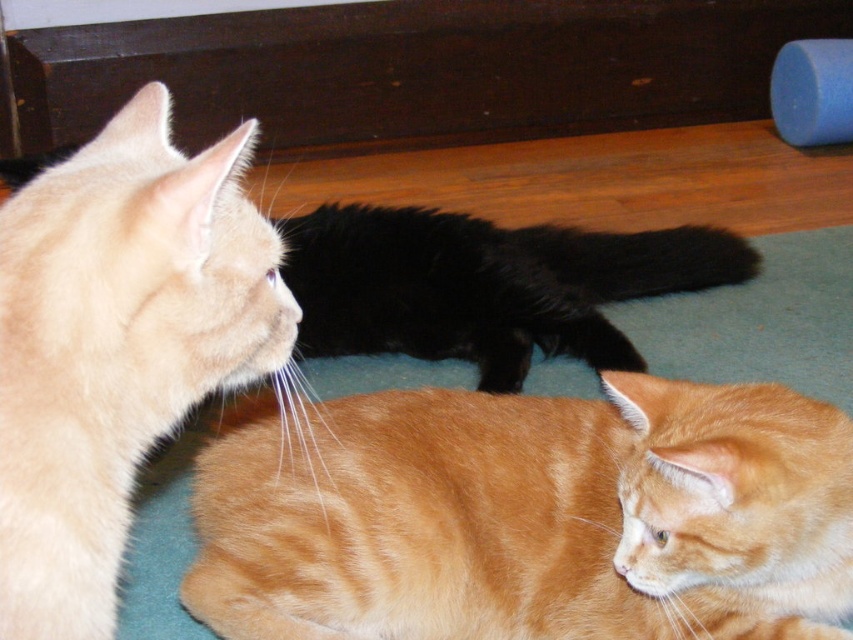
In the scene shown: Who is more distant from viewer, [607,570] or [149,250]?

The point [607,570] is more distant.

Between orange fur cat at lower center and light orange fur cat at upper left, which one is positioned higher?

light orange fur cat at upper left is higher up.

Is point (428, 388) farther from viewer compared to point (67, 481)?

That is True.

Where is `orange fur cat at lower center`? The width and height of the screenshot is (853, 640). orange fur cat at lower center is located at coordinates (531, 516).

Is light orange fur cat at upper left shorter than black fluffy cat at center?

Incorrect, light orange fur cat at upper left's height does not fall short of black fluffy cat at center's.

Consider the image. Between light orange fur cat at upper left and black fluffy cat at center, which one is positioned lower?

light orange fur cat at upper left is below.

At what (x,y) coordinates should I click in order to perform the action: click on light orange fur cat at upper left. Please return your answer as a coordinate pair (x, y). Looking at the image, I should click on (119, 346).

Identify the location of light orange fur cat at upper left. This screenshot has height=640, width=853. (119, 346).

Which of these two, orange fur cat at lower center or black fluffy cat at center, stands shorter?

With less height is orange fur cat at lower center.

Can you confirm if orange fur cat at lower center is positioned below black fluffy cat at center?

Yes.

Does point (717, 550) lie in front of point (712, 228)?

Yes, point (717, 550) is closer to viewer.

Where is `orange fur cat at lower center`? orange fur cat at lower center is located at coordinates (531, 516).